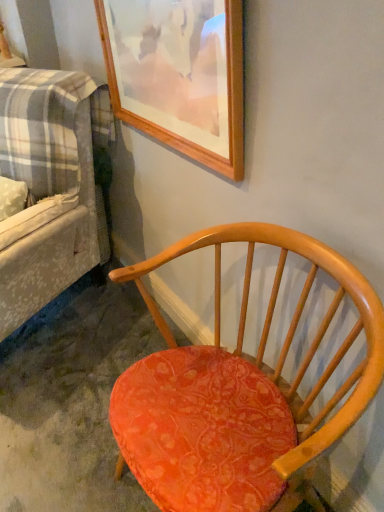
Question: Considering the relative sizes of plaid fabric couch at left and wooden picture frame at upper center in the image provided, is plaid fabric couch at left smaller than wooden picture frame at upper center?

Choices:
 (A) yes
 (B) no

Answer: (B)

Question: Is plaid fabric couch at left completely or partially outside of wooden picture frame at upper center?

Choices:
 (A) yes
 (B) no

Answer: (A)

Question: Is wooden picture frame at upper center a part of plaid fabric couch at left?

Choices:
 (A) yes
 (B) no

Answer: (B)

Question: Considering the relative sizes of plaid fabric couch at left and wooden picture frame at upper center in the image provided, is plaid fabric couch at left bigger than wooden picture frame at upper center?

Choices:
 (A) yes
 (B) no

Answer: (A)

Question: From a real-world perspective, does plaid fabric couch at left stand above wooden picture frame at upper center?

Choices:
 (A) yes
 (B) no

Answer: (B)

Question: Is matte orange fabric chair at center to the left or to the right of plaid fabric couch at left in the image?

Choices:
 (A) right
 (B) left

Answer: (A)

Question: Is point (117, 471) positioned closer to the camera than point (91, 263)?

Choices:
 (A) closer
 (B) farther

Answer: (A)

Question: Is matte orange fabric chair at center wider or thinner than plaid fabric couch at left?

Choices:
 (A) thin
 (B) wide

Answer: (A)

Question: Considering their positions, is matte orange fabric chair at center located in front of or behind plaid fabric couch at left?

Choices:
 (A) behind
 (B) front

Answer: (B)

Question: Choose the correct answer: Is wooden picture frame at upper center inside plaid fabric couch at left or outside it?

Choices:
 (A) outside
 (B) inside

Answer: (A)

Question: From the image's perspective, is wooden picture frame at upper center positioned above or below plaid fabric couch at left?

Choices:
 (A) below
 (B) above

Answer: (B)

Question: Relative to plaid fabric couch at left, is wooden picture frame at upper center in front or behind?

Choices:
 (A) behind
 (B) front

Answer: (B)

Question: Is point (167, 133) positioned closer to the camera than point (74, 156)?

Choices:
 (A) farther
 (B) closer

Answer: (B)

Question: Is plaid fabric couch at left inside or outside of wooden picture frame at upper center?

Choices:
 (A) inside
 (B) outside

Answer: (B)

Question: Considering their positions, is plaid fabric couch at left located in front of or behind wooden picture frame at upper center?

Choices:
 (A) front
 (B) behind

Answer: (B)